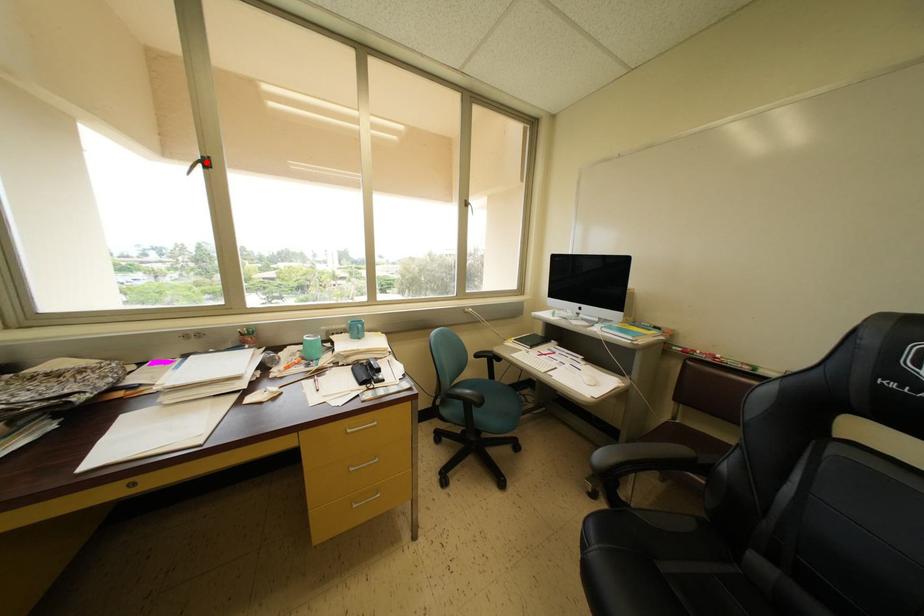
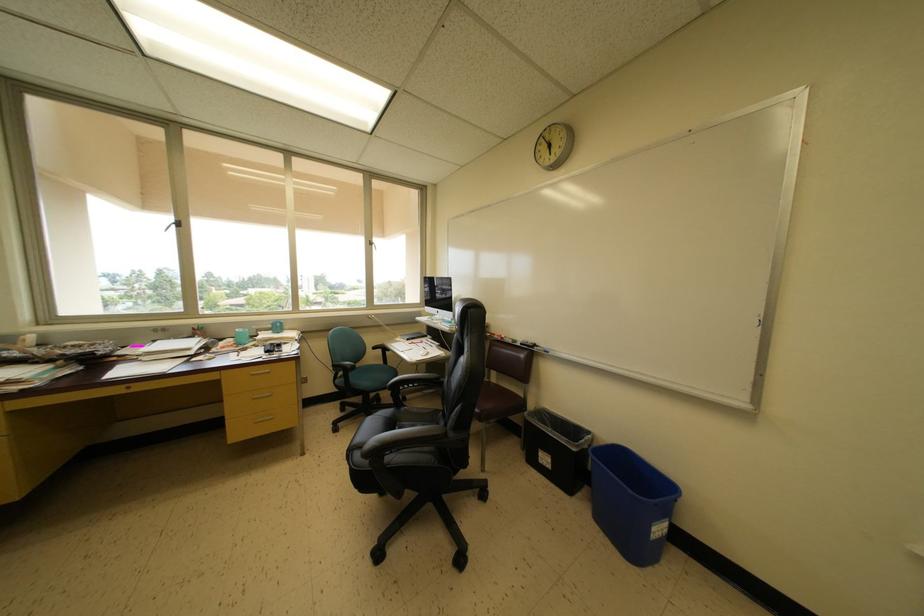
Find the pixel in the second image that matches the highlighted location in the first image.

(179, 225)